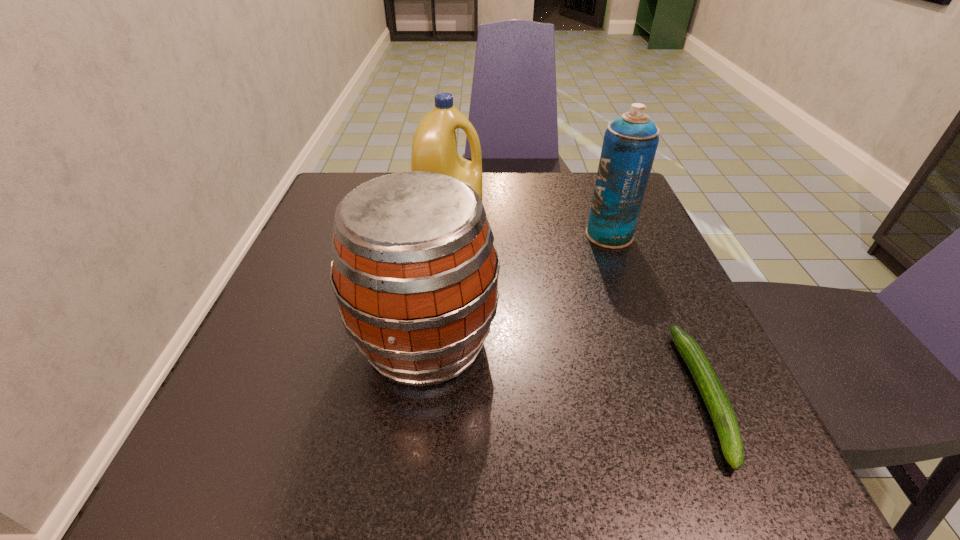
Find the location of a particular element. The height and width of the screenshot is (540, 960). aerosol can that is at the right edge is located at coordinates (630, 142).

The height and width of the screenshot is (540, 960). In order to click on zucchini situated at the right edge in this screenshot , I will do `click(712, 392)`.

At what (x,y) coordinates should I click in order to perform the action: click on object at the far right corner. Please return your answer as a coordinate pair (x, y). The width and height of the screenshot is (960, 540). Looking at the image, I should click on (630, 142).

This screenshot has height=540, width=960. I want to click on object that is positioned at the near right corner, so click(x=712, y=392).

Identify the location of vacant space at the far edge. The width and height of the screenshot is (960, 540). (536, 193).

You are a GUI agent. You are given a task and a screenshot of the screen. Output one action in this format:
    pyautogui.click(x=<x>, y=<y>)
    Task: Click on the free location at the left edge of the desktop
    The width and height of the screenshot is (960, 540).
    Given the screenshot: What is the action you would take?
    pyautogui.click(x=303, y=336)

The width and height of the screenshot is (960, 540). What are the coordinates of `vacant space at the right edge of the desktop` in the screenshot? It's located at (684, 303).

In order to click on free space at the near left corner of the desktop in this screenshot , I will do `click(164, 501)`.

I want to click on free location at the near right corner of the desktop, so click(717, 495).

Find the location of `free space that is in between the aerosol can and the cider`. free space that is in between the aerosol can and the cider is located at coordinates (517, 288).